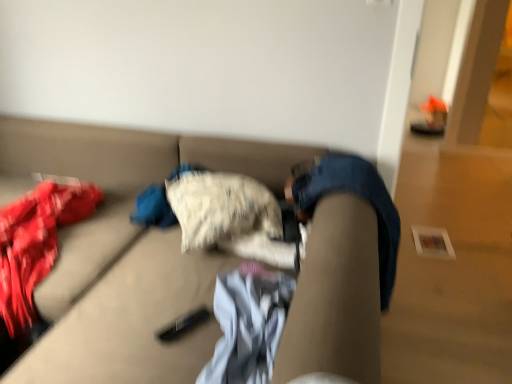
Question: Should I look upward or downward to see textured beige couch at center?

Choices:
 (A) up
 (B) down

Answer: (B)

Question: Is white cotton shirt at center not close to textured beige couch at center?

Choices:
 (A) no
 (B) yes

Answer: (A)

Question: Does white cotton shirt at center touch textured beige couch at center?

Choices:
 (A) no
 (B) yes

Answer: (A)

Question: From the image's perspective, is white cotton shirt at center over textured beige couch at center?

Choices:
 (A) no
 (B) yes

Answer: (A)

Question: From the image's perspective, is white cotton shirt at center under textured beige couch at center?

Choices:
 (A) no
 (B) yes

Answer: (B)

Question: Considering the relative positions of white cotton shirt at center and textured beige couch at center in the image provided, is white cotton shirt at center in front of textured beige couch at center?

Choices:
 (A) yes
 (B) no

Answer: (B)

Question: Is white cotton shirt at center looking in the opposite direction of textured beige couch at center?

Choices:
 (A) no
 (B) yes

Answer: (B)

Question: Could white cotton shirt at center be considered to be inside textured beige couch at center?

Choices:
 (A) no
 (B) yes

Answer: (B)

Question: Considering the relative sizes of textured beige couch at center and white cotton shirt at center in the image provided, is textured beige couch at center taller than white cotton shirt at center?

Choices:
 (A) yes
 (B) no

Answer: (A)

Question: Can you confirm if textured beige couch at center is bigger than white cotton shirt at center?

Choices:
 (A) no
 (B) yes

Answer: (B)

Question: Are textured beige couch at center and white cotton shirt at center far apart?

Choices:
 (A) no
 (B) yes

Answer: (A)

Question: Considering the relative sizes of textured beige couch at center and white cotton shirt at center in the image provided, is textured beige couch at center smaller than white cotton shirt at center?

Choices:
 (A) no
 (B) yes

Answer: (A)

Question: Is textured beige couch at center to the left of white cotton shirt at center from the viewer's perspective?

Choices:
 (A) yes
 (B) no

Answer: (A)

Question: Is point coord(273,288) positioned closer to the camera than point coord(205,256)?

Choices:
 (A) farther
 (B) closer

Answer: (B)